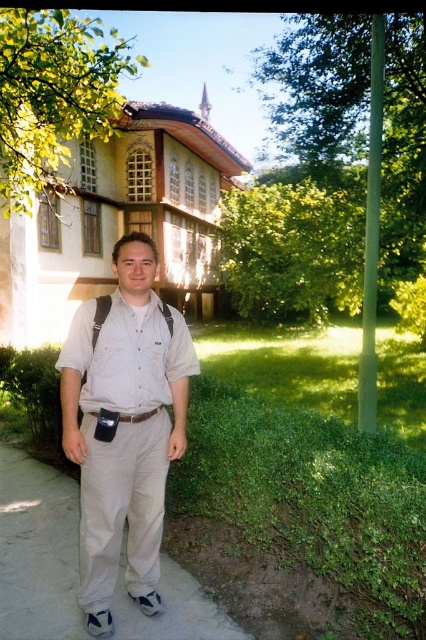
Who is more distant from viewer, (143, 572) or (97, 298)?

Point (143, 572)

Between point (132, 444) and point (97, 333), which one is positioned in front?

Point (97, 333) is more forward.

Which is behind, point (81, 552) or point (169, 310)?

Positioned behind is point (169, 310).

I want to click on khaki pants at center, so click(x=121, y=509).

Is light beige cotton shirt at center wider than khaki pants at center?

Correct, the width of light beige cotton shirt at center exceeds that of khaki pants at center.

Who is positioned more to the left, light beige cotton shirt at center or khaki pants at center?

Positioned to the left is light beige cotton shirt at center.

You are a GUI agent. You are given a task and a screenshot of the screen. Output one action in this format:
    pyautogui.click(x=<x>, y=<y>)
    Task: Click on the light beige cotton shirt at center
    
    Given the screenshot: What is the action you would take?
    pyautogui.click(x=123, y=428)

Find the location of a particular element. light beige cotton shirt at center is located at coordinates (123, 428).

Can you confirm if khaki pants at center is shorter than black leather belt at center?

No, khaki pants at center is not shorter than black leather belt at center.

Between point (138, 579) and point (149, 412), which one is positioned in front?

Point (149, 412)

The height and width of the screenshot is (640, 426). I want to click on khaki pants at center, so click(x=121, y=509).